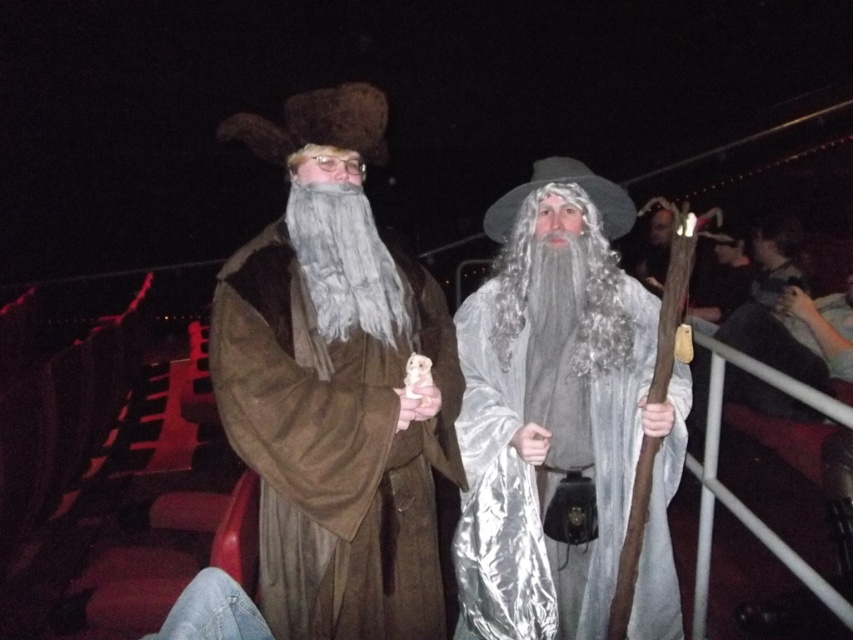
You are a photographer standing at the camera position. You want to take a closeup shot of the silver satin robe at center. Considering the robe is 1.82 meters away from the camera, what is the minimum focal length required to capture the entire robe in the frame if your camera has a sensor size of 24mm x 36mm and the robe is 1.2 meters wide?

The minimum focal length required is calculated using the formula focal length > sensor width x distance divided by subject width. Plugging in the numbers, 24mm x 1.82m divided by 1.2m equals approximately 36.4mm. Therefore, a focal length greater than 36.4mm would be needed to capture the entire silver satin robe at center in the frame.